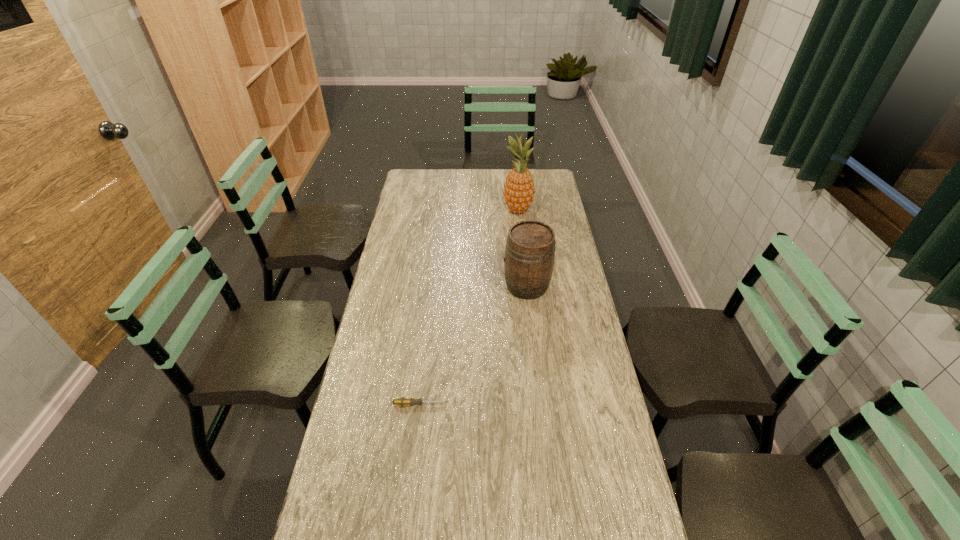
The width and height of the screenshot is (960, 540). I want to click on free space between the farthest object and the screwdriver, so click(469, 307).

The width and height of the screenshot is (960, 540). Find the location of `vacant area that lies between the leftmost object and the tallest object`. vacant area that lies between the leftmost object and the tallest object is located at coordinates (469, 307).

This screenshot has height=540, width=960. I want to click on free space that is in between the screwdriver and the farthest object, so click(x=469, y=307).

Locate an element on the screen. The height and width of the screenshot is (540, 960). the second closest object relative to the nearest object is located at coordinates (519, 190).

Locate which object is the second closest to the leftmost object. Please provide its 2D coordinates. Your answer should be formatted as a tuple, i.e. [(x, y)], where the tuple contains the x and y coordinates of a point satisfying the conditions above.

[(519, 190)]